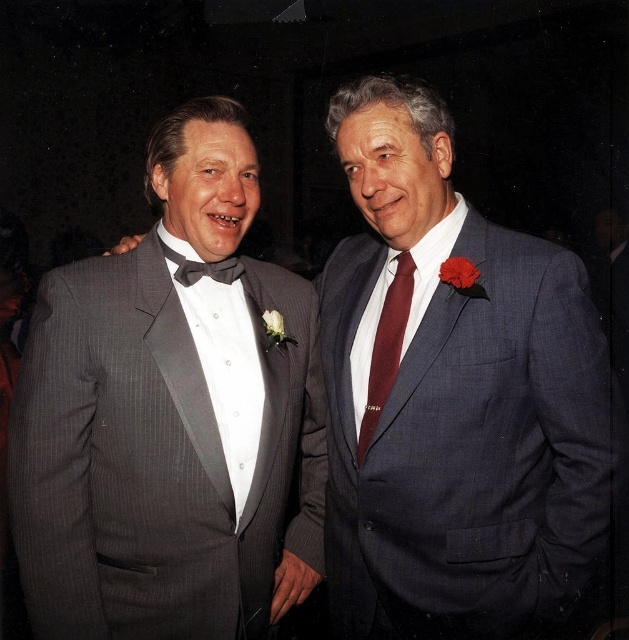
Question: Does matte gray tuxedo at left have a larger size compared to dark blue textured suit at right?

Choices:
 (A) yes
 (B) no

Answer: (A)

Question: Is matte gray tuxedo at left further to camera compared to gray pinstripe tuxedo at left?

Choices:
 (A) no
 (B) yes

Answer: (B)

Question: Which object appears farthest from the camera in this image?

Choices:
 (A) maroon silk tie at center
 (B) gray pinstripe tuxedo at left

Answer: (A)

Question: Among these objects, which one is nearest to the camera?

Choices:
 (A) dark blue textured suit at right
 (B) maroon silk tie at center
 (C) matte gray tuxedo at left

Answer: (C)

Question: Is dark blue textured suit at right closer to the viewer compared to black satin bow tie at left?

Choices:
 (A) no
 (B) yes

Answer: (B)

Question: Based on their relative distances, which object is nearer to the gray pinstripe tuxedo at left?

Choices:
 (A) matte gray tuxedo at left
 (B) dark blue textured suit at right

Answer: (B)